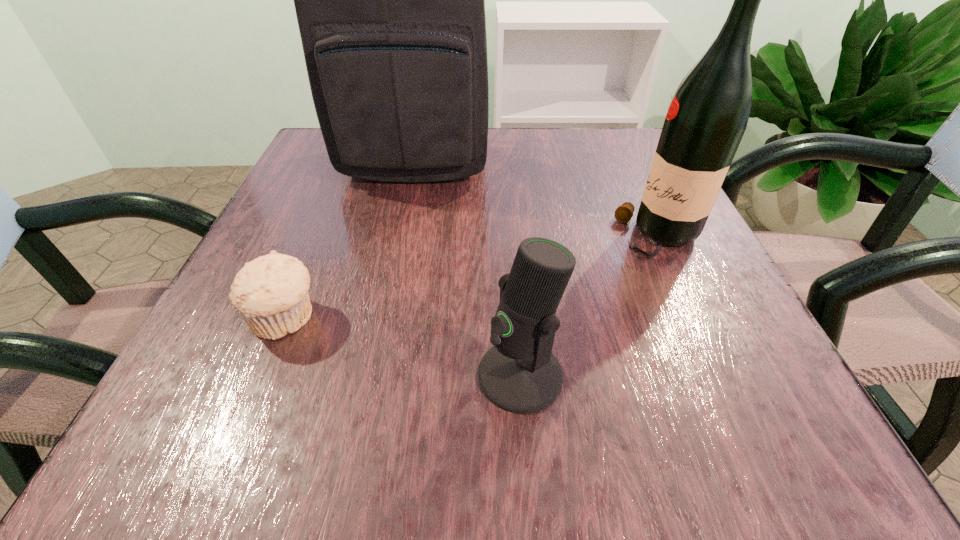
This screenshot has height=540, width=960. What are the coordinates of `vacant area that lies between the third shortest object and the muffin` in the screenshot? It's located at (472, 278).

Where is `the closest object to the third tallest object`? The image size is (960, 540). the closest object to the third tallest object is located at coordinates (705, 122).

Point out which object is positioned as the second nearest to the third shortest object. Please provide its 2D coordinates. Your answer should be formatted as a tuple, i.e. [(x, y)], where the tuple contains the x and y coordinates of a point satisfying the conditions above.

[(390, 0)]

At what (x,y) coordinates should I click in order to perform the action: click on vacant area in the image that satisfies the following two spatial constraints: 1. on the back side of the second shortest object; 2. on the right side of the second tallest object. Please return your answer as a coordinate pair (x, y). Looking at the image, I should click on (510, 237).

I want to click on free space that satisfies the following two spatial constraints: 1. on the front-facing side of the rightmost object; 2. on the right side of the tallest object, so click(400, 237).

Where is `free space that satisfies the following two spatial constraints: 1. on the front-facing side of the second tallest object; 2. on the right side of the backpack`? This screenshot has height=540, width=960. free space that satisfies the following two spatial constraints: 1. on the front-facing side of the second tallest object; 2. on the right side of the backpack is located at coordinates (400, 237).

At what (x,y) coordinates should I click in order to perform the action: click on vacant point that satisfies the following two spatial constraints: 1. on the front-facing side of the wine bottle; 2. on the left side of the farthest object. Please return your answer as a coordinate pair (x, y). Looking at the image, I should click on (400, 237).

What are the coordinates of `free space that satisfies the following two spatial constraints: 1. on the front-facing side of the microphone; 2. on the right side of the tallest object` in the screenshot? It's located at (372, 375).

Where is `free point that satisfies the following two spatial constraints: 1. on the front side of the second shortest object; 2. on the right side of the muffin`? The height and width of the screenshot is (540, 960). free point that satisfies the following two spatial constraints: 1. on the front side of the second shortest object; 2. on the right side of the muffin is located at coordinates (261, 375).

This screenshot has height=540, width=960. What are the coordinates of `vacant point that satisfies the following two spatial constraints: 1. on the front-facing side of the farthest object; 2. on the left side of the third shortest object` in the screenshot? It's located at (400, 237).